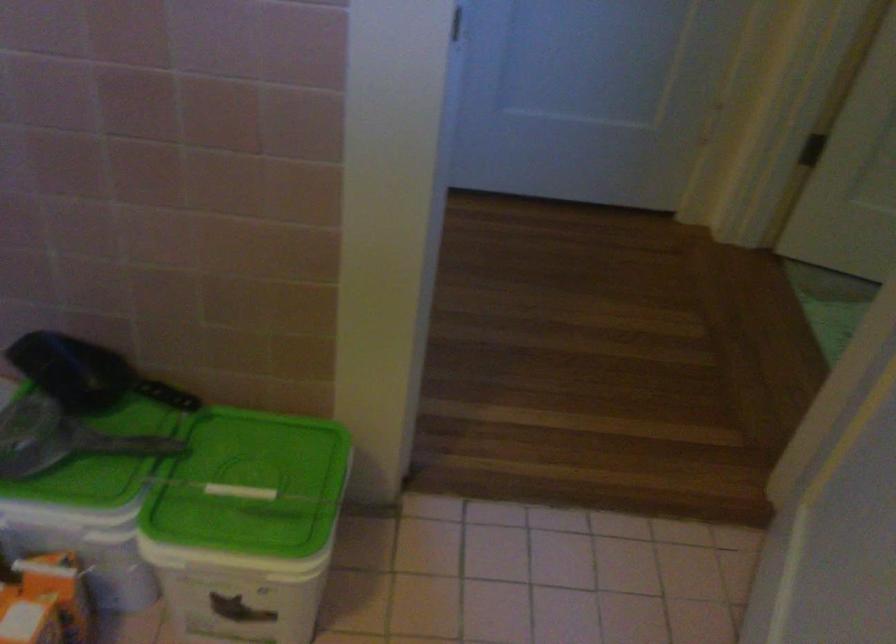
Locate an element on the screen. This screenshot has width=896, height=644. grey scoop handle is located at coordinates (81, 448).